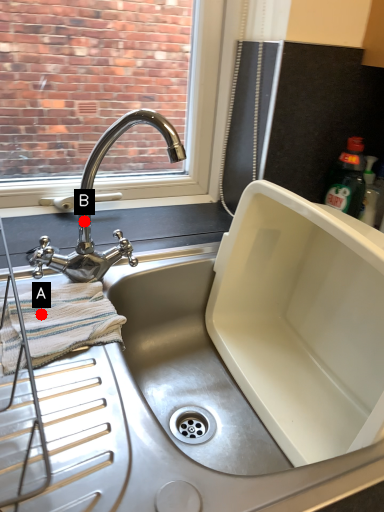
Question: Two points are circled on the image, labeled by A and B beside each circle. Which of the following is the farthest from the observer?

Choices:
 (A) A is further
 (B) B is further

Answer: (B)